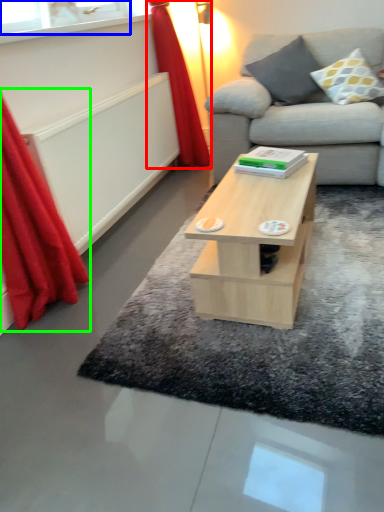
Question: Based on their relative distances, which object is nearer to curtain (highlighted by a red box)? Choose from window (highlighted by a blue box) and curtain (highlighted by a green box).

Choices:
 (A) window
 (B) curtain

Answer: (A)